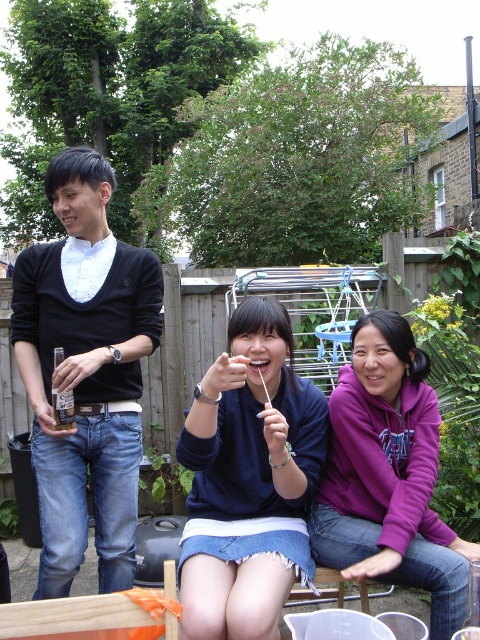
Question: Based on their relative distances, which object is nearer to the dark blue sweater at center?

Choices:
 (A) purple fleece at center
 (B) black sweater at left

Answer: (A)

Question: Is black sweater at left bigger than dark blue sweater at center?

Choices:
 (A) yes
 (B) no

Answer: (A)

Question: Which point appears closest to the camera in this image?

Choices:
 (A) [x=87, y=362]
 (B) [x=277, y=316]
 (C) [x=400, y=460]

Answer: (B)

Question: Which point is closer to the camera taking this photo?

Choices:
 (A) (435, 518)
 (B) (84, 257)
 (C) (247, 401)

Answer: (C)

Question: Where is black sweater at left located in relation to dark blue sweater at center in the image?

Choices:
 (A) right
 (B) left

Answer: (B)

Question: Can you confirm if dark blue sweater at center is bigger than purple fleece at center?

Choices:
 (A) no
 (B) yes

Answer: (A)